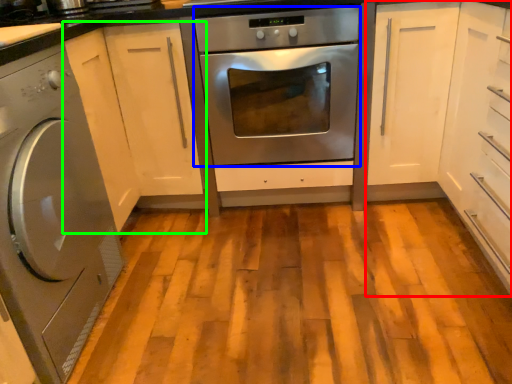
Question: Estimate the real-world distances between objects in this image. Which object is closer to cabinetry (highlighted by a red box), oven (highlighted by a blue box) or cabinetry (highlighted by a green box)?

Choices:
 (A) oven
 (B) cabinetry

Answer: (A)